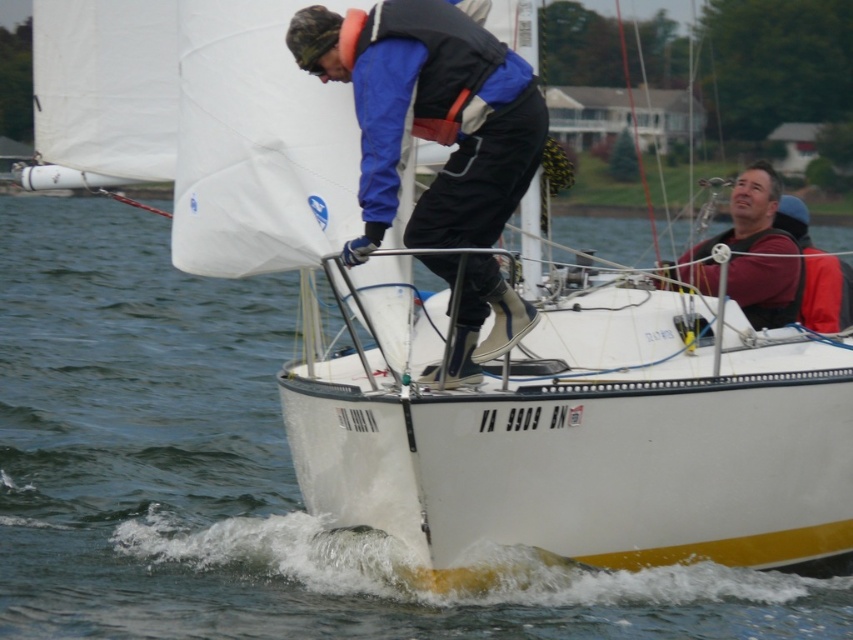
Question: Considering the real-world distances, which object is farthest from the white water at center?

Choices:
 (A) matte blue jacket at center
 (B) maroon fabric life vest at upper right

Answer: (B)

Question: Can you confirm if white water at center is positioned to the left of maroon fabric life vest at upper right?

Choices:
 (A) yes
 (B) no

Answer: (A)

Question: Based on their relative distances, which object is farther from the white water at center?

Choices:
 (A) matte blue jacket at center
 (B) maroon fabric life vest at upper right

Answer: (B)

Question: Is white water at center bigger than matte blue jacket at center?

Choices:
 (A) yes
 (B) no

Answer: (A)

Question: Estimate the real-world distances between objects in this image. Which object is farther from the maroon fabric life vest at upper right?

Choices:
 (A) matte blue jacket at center
 (B) white water at center

Answer: (B)

Question: Does white water at center appear on the left side of maroon fabric life vest at upper right?

Choices:
 (A) no
 (B) yes

Answer: (B)